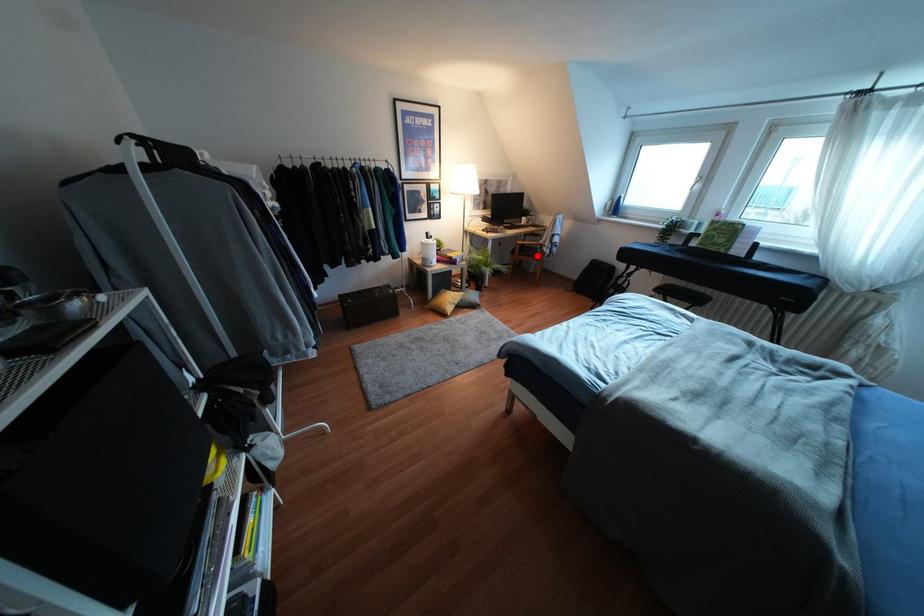
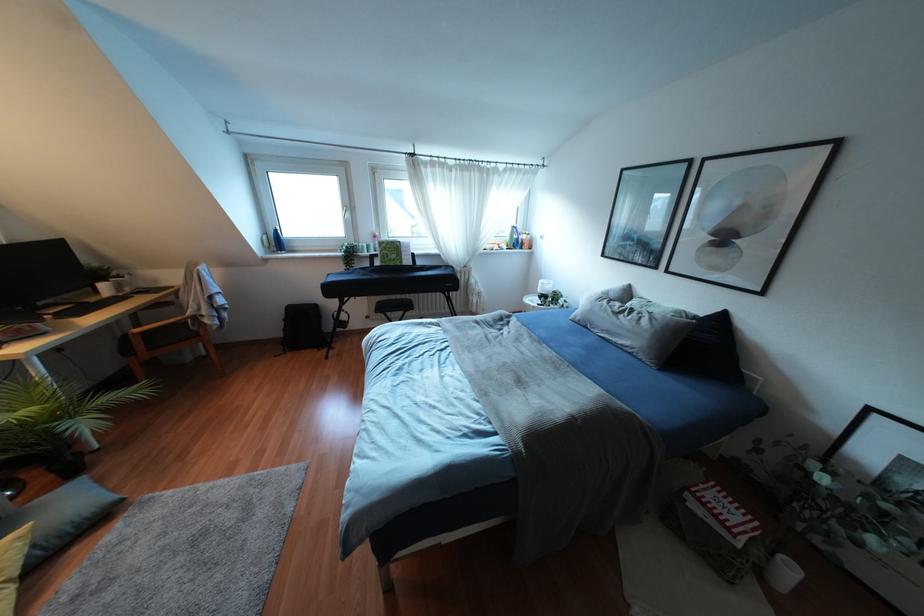
Question: I am providing you with two images of the same scene from different viewpoints. Image1 has a red point marked. In image2, the corresponding 3D location appears at what relative position? Reply with the corresponding letter.

Choices:
 (A) Closer
 (B) Farther

Answer: (B)